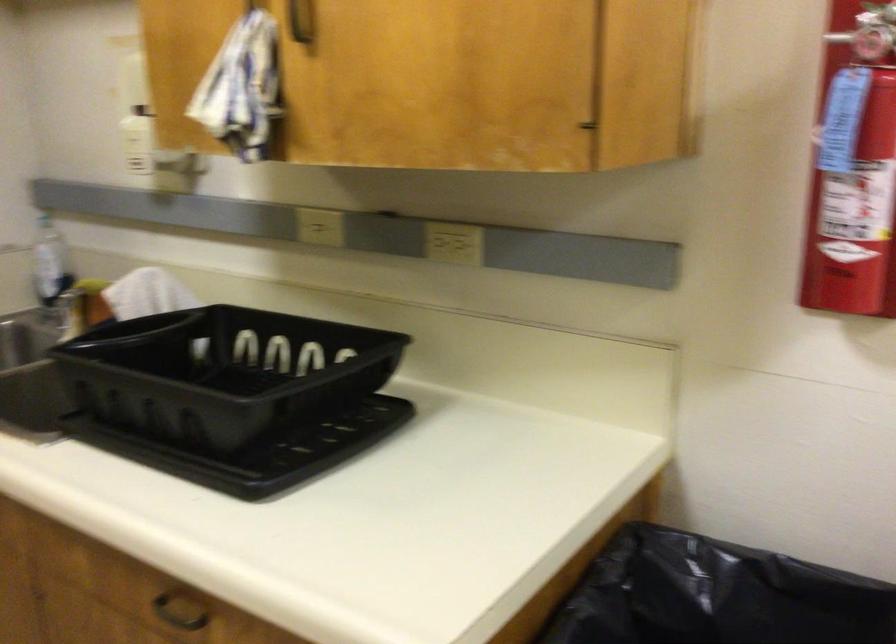
What do you see at coordinates (869, 44) in the screenshot?
I see `the fire extinguisher lever` at bounding box center [869, 44].